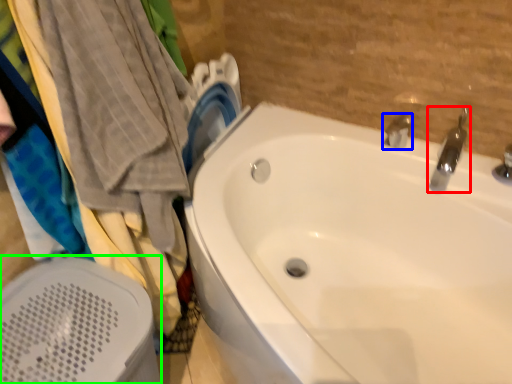
Question: Which object is the closest to the tap (highlighted by a red box)? Choose among these: tap (highlighted by a blue box) or bath heater (highlighted by a green box).

Choices:
 (A) tap
 (B) bath heater

Answer: (A)